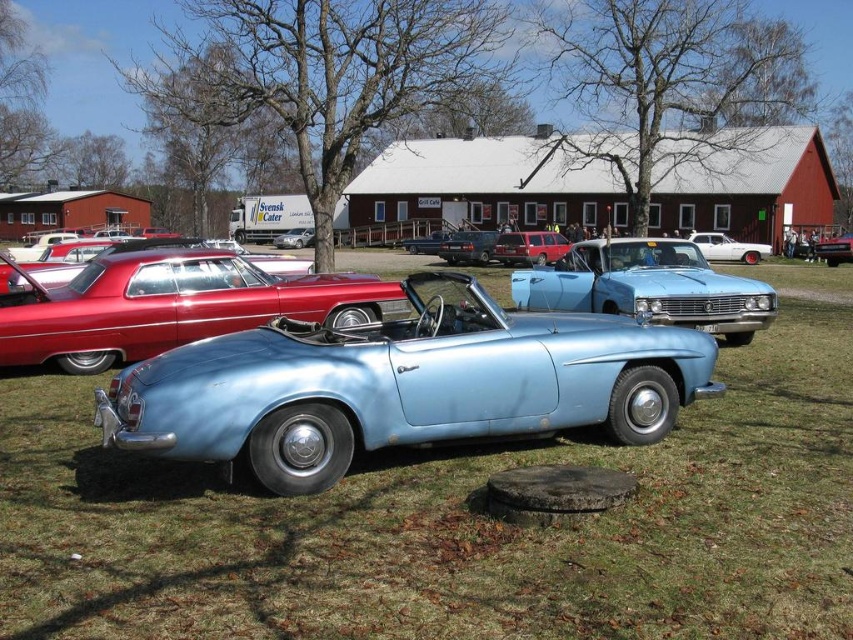
Question: Which object is positioned closest to the white glossy sedan at center?

Choices:
 (A) metallic red car at right
 (B) satin black car at center
 (C) shiny metallic car at center

Answer: (A)

Question: Is light green grass at center to the right of metallic silver car at center from the viewer's perspective?

Choices:
 (A) yes
 (B) no

Answer: (A)

Question: Which point is farther from the camera taking this photo?

Choices:
 (A) [704, 250]
 (B) [480, 298]
 (C) [471, 241]
 (D) [543, 243]

Answer: (A)

Question: Can you confirm if light blue metallic car at center is positioned to the right of matte red station wagon at center?

Choices:
 (A) yes
 (B) no

Answer: (B)

Question: Is light green grass at center below metallic silver car at center?

Choices:
 (A) yes
 (B) no

Answer: (A)

Question: Among these points, which one is farthest from the camera?

Choices:
 (A) (473, 298)
 (B) (367, 584)
 (C) (630, 301)

Answer: (C)